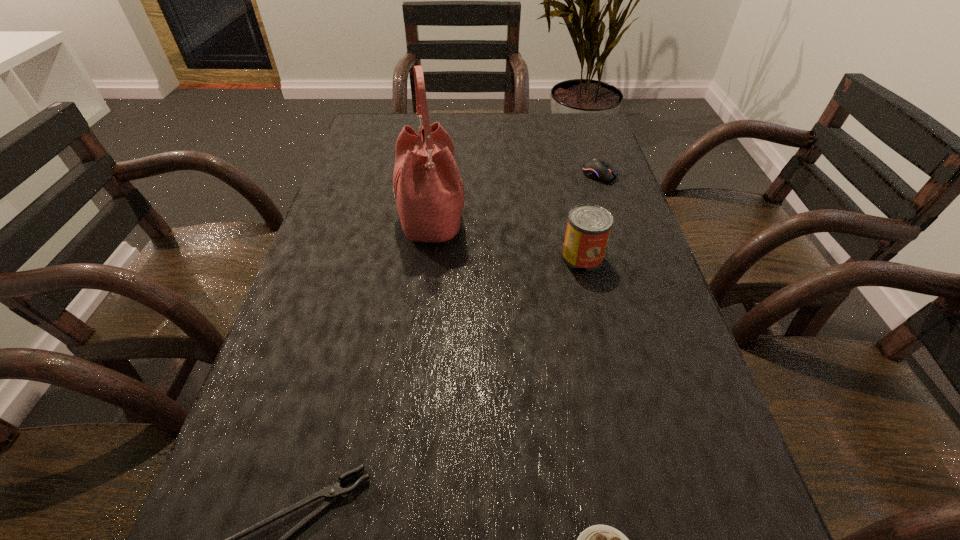
Image resolution: width=960 pixels, height=540 pixels. Find the location of `handbag`. handbag is located at coordinates (429, 193).

At what (x,y) coordinates should I click in order to perform the action: click on can. Please return your answer as a coordinate pair (x, y). The image size is (960, 540). Looking at the image, I should click on (588, 229).

Find the location of a particular element. Image resolution: width=960 pixels, height=540 pixels. the third shortest object is located at coordinates (598, 169).

Identify the location of the farthest object. The height and width of the screenshot is (540, 960). (598, 169).

This screenshot has height=540, width=960. Find the location of `free region located on the right of the handbag`. free region located on the right of the handbag is located at coordinates (600, 222).

In order to click on vacant region located on the front of the fourth shortest object in this screenshot , I will do `click(601, 339)`.

You are a GUI agent. You are given a task and a screenshot of the screen. Output one action in this format:
    pyautogui.click(x=<x>, y=<y>)
    Task: Click on the free space located 0.270m on the front of the third shortest object
    The width and height of the screenshot is (960, 540).
    Given the screenshot: What is the action you would take?
    pyautogui.click(x=627, y=258)

Locate an element on the screen. can at the right edge is located at coordinates (588, 229).

Where is `computer mouse situated at the right edge`? The height and width of the screenshot is (540, 960). computer mouse situated at the right edge is located at coordinates (598, 169).

At what (x,y) coordinates should I click in order to perform the action: click on vacant space at the far edge. Please return your answer as a coordinate pair (x, y). The width and height of the screenshot is (960, 540). Looking at the image, I should click on (510, 137).